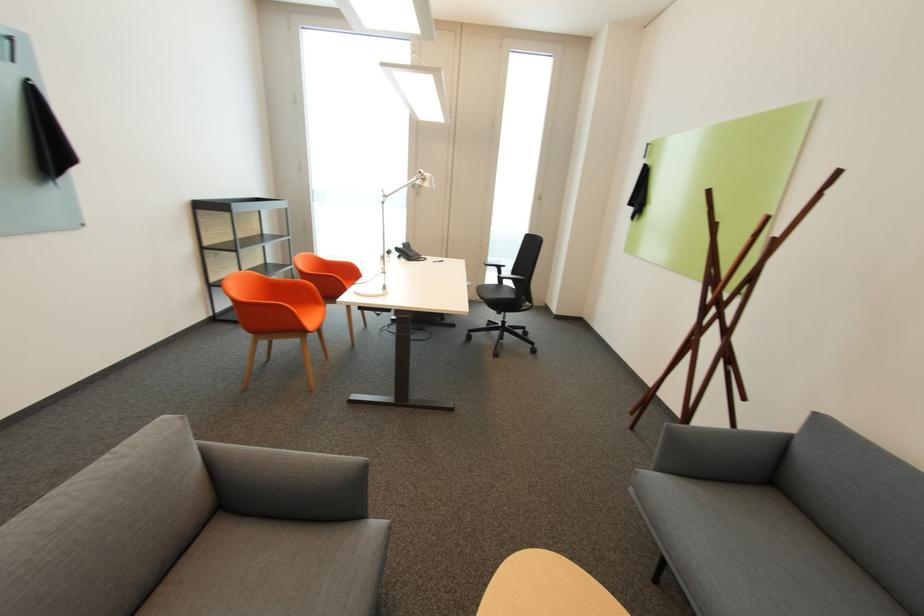
Identify the location of black chair sitting surface. [499, 296].